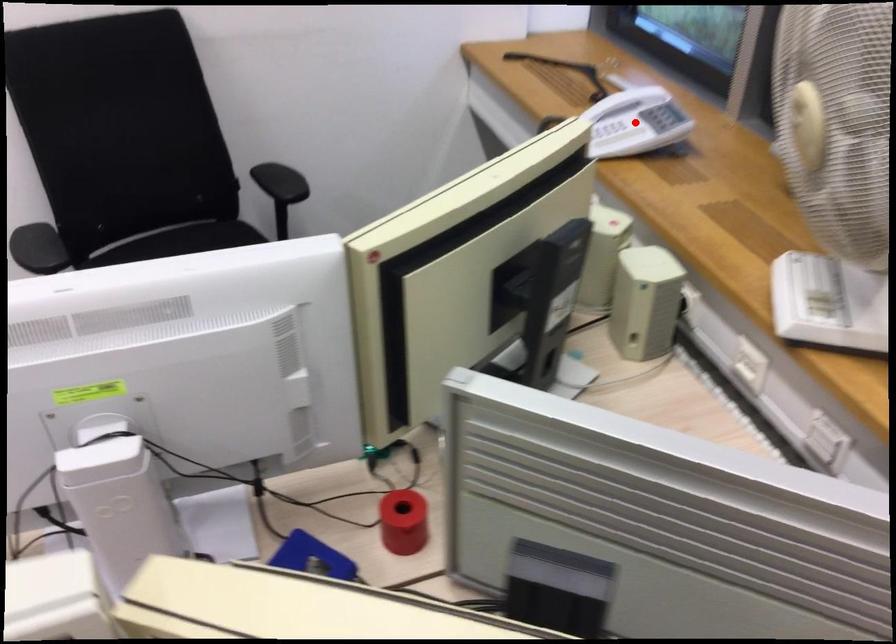
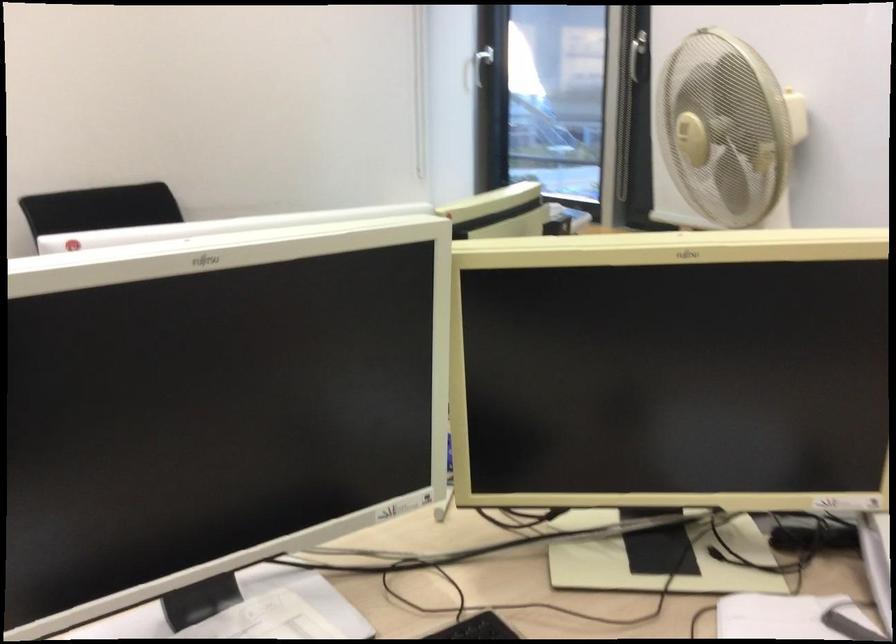
Question: I am providing you with two images of the same scene from different viewpoints. A red point is marked on the first image. At the location where the point appears in image 1, is it still visible in image 2?

Choices:
 (A) Yes
 (B) No

Answer: (B)